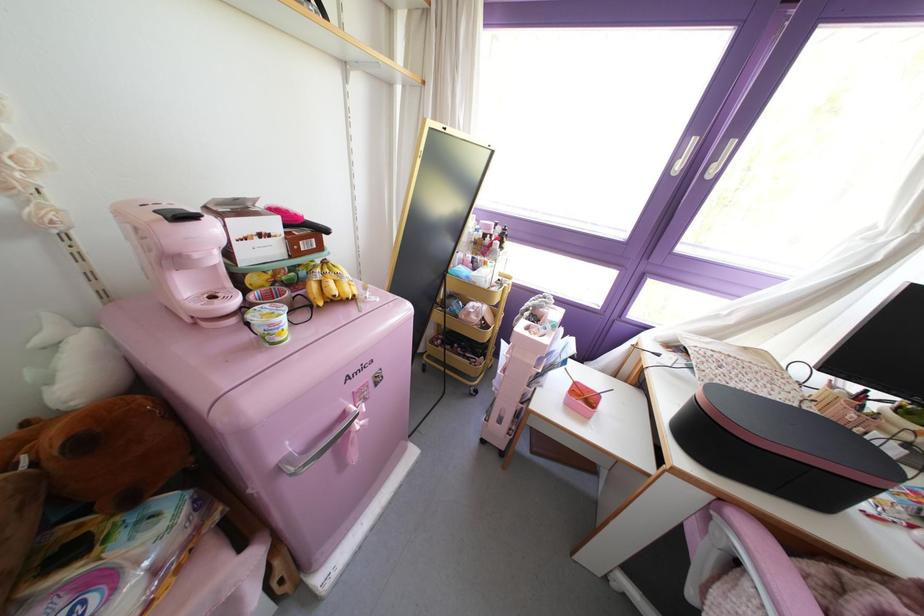
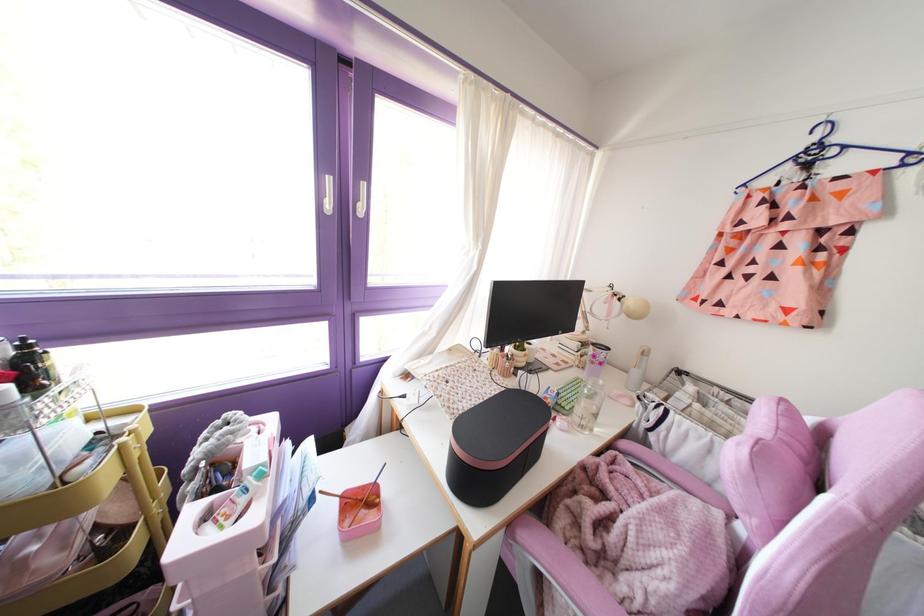
In the second image, find the point that corresponds to [501,246] in the first image.

(32, 389)